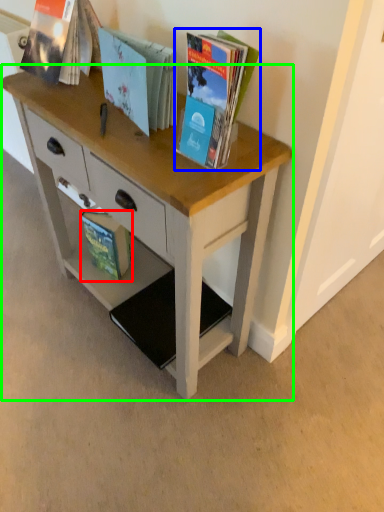
Question: Considering the real-world distances, which object is closest to book (highlighted by a red box)? book (highlighted by a blue box) or desk (highlighted by a green box).

Choices:
 (A) book
 (B) desk

Answer: (B)